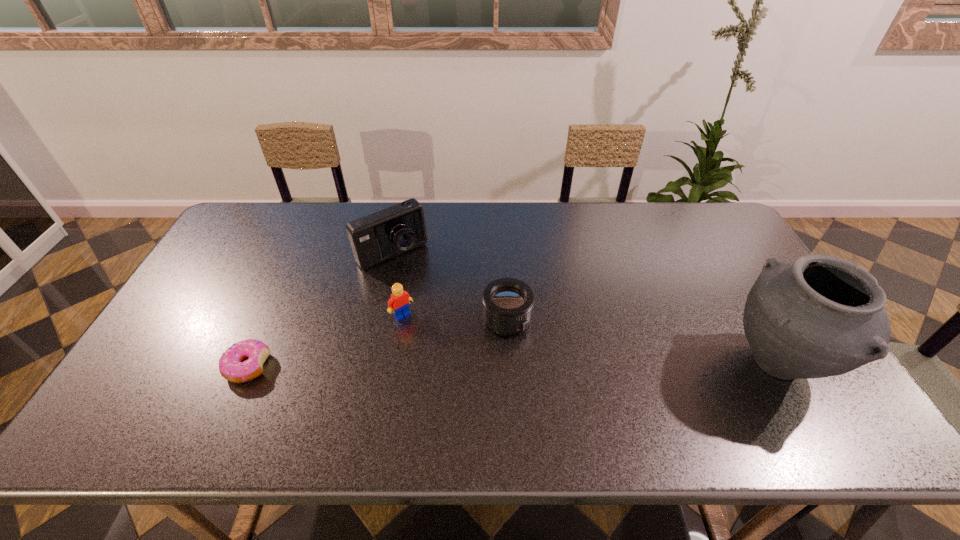
Image resolution: width=960 pixels, height=540 pixels. Identify the location of the shortest object. (232, 367).

Locate an element on the screen. the leftmost object is located at coordinates (232, 367).

Locate an element on the screen. Image resolution: width=960 pixels, height=540 pixels. urn is located at coordinates (820, 316).

The width and height of the screenshot is (960, 540). I want to click on the rightmost object, so click(x=820, y=316).

Where is `the farthest object`? This screenshot has width=960, height=540. the farthest object is located at coordinates (382, 235).

Identify the location of camera. (382, 235).

Identify the location of the second shortest object. (507, 303).

Find the location of a particular element. This screenshot has width=960, height=540. telephoto lens is located at coordinates coord(507,303).

In order to click on Lego in this screenshot , I will do `click(398, 304)`.

I want to click on vacant region located on the left of the shortest object, so click(x=174, y=366).